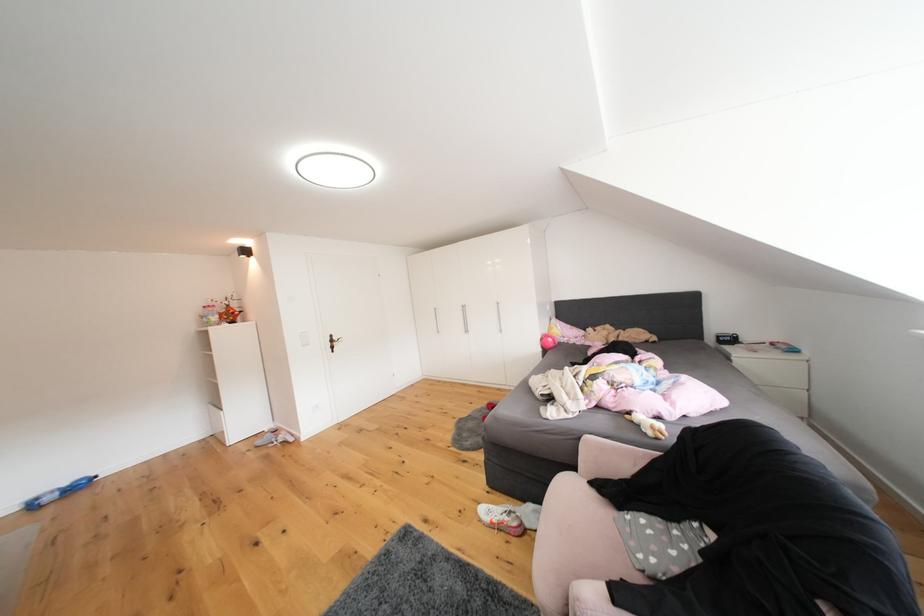
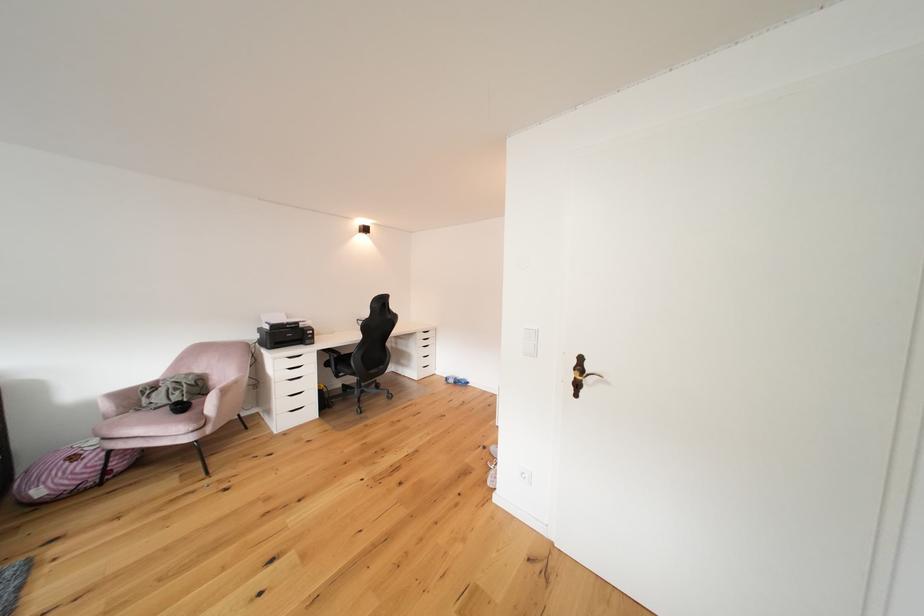
Question: I am providing you with two images of the same scene from different viewpoints. Which of the following objects are not visible in image2?

Choices:
 (A) black drawer handle
 (B) pink chair armrest
 (C) pink chair sitting surface
 (D) none of these

Answer: (D)